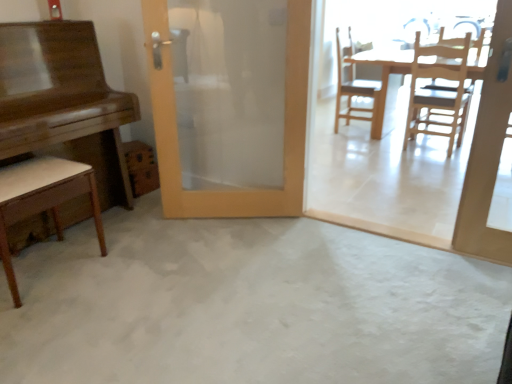
Question: Can you confirm if wooden door at center is wider than light brown wood chair at lower left, which appears as the 3th chair when viewed from the right?

Choices:
 (A) yes
 (B) no

Answer: (B)

Question: Can you confirm if wooden door at center is taller than light brown wood chair at lower left, arranged as the first chair when viewed from the left?

Choices:
 (A) yes
 (B) no

Answer: (A)

Question: Does wooden door at center lie in front of light brown wood chair at lower left, arranged as the first chair when viewed from the left?

Choices:
 (A) no
 (B) yes

Answer: (A)

Question: Is light brown wood chair at lower left, which is the first chair from front to back, at the back of wooden door at center?

Choices:
 (A) yes
 (B) no

Answer: (B)

Question: Does wooden door at center appear on the right side of light brown wood chair at lower left, which ranks as the 3th chair in back-to-front order?

Choices:
 (A) no
 (B) yes

Answer: (B)

Question: Is wooden door at center thinner than light brown wood chair at lower left, which appears as the 3th chair when viewed from the right?

Choices:
 (A) no
 (B) yes

Answer: (B)

Question: Does white concrete floor at center have a greater width compared to shiny brown piano at left, which is the first table in front-to-back order?

Choices:
 (A) yes
 (B) no

Answer: (A)

Question: Is white concrete floor at center next to shiny brown piano at left, which is the first table in front-to-back order?

Choices:
 (A) yes
 (B) no

Answer: (B)

Question: Is white concrete floor at center at the right side of shiny brown piano at left, which is the first table in front-to-back order?

Choices:
 (A) yes
 (B) no

Answer: (A)

Question: Does white concrete floor at center come in front of shiny brown piano at left, which is the first table in front-to-back order?

Choices:
 (A) yes
 (B) no

Answer: (A)

Question: Is white concrete floor at center not within shiny brown piano at left, which is counted as the second table, starting from the back?

Choices:
 (A) no
 (B) yes

Answer: (B)

Question: From a real-world perspective, is white concrete floor at center physically below shiny brown piano at left, which is counted as the second table, starting from the back?

Choices:
 (A) yes
 (B) no

Answer: (A)

Question: Is wooden at right, which ranks as the 1th chair in back-to-front order, completely or partially inside light wood table at center, positioned as the 1th table in right-to-left order?

Choices:
 (A) no
 (B) yes

Answer: (B)